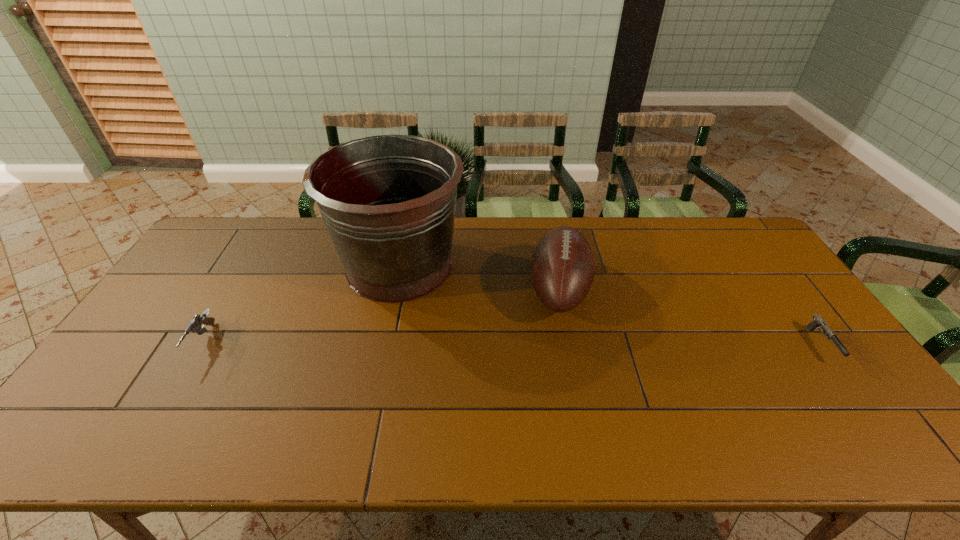
The height and width of the screenshot is (540, 960). I want to click on vacant area that lies between the bucket and the shortest object, so click(x=611, y=305).

Locate an element on the screen. The width and height of the screenshot is (960, 540). free spot between the second tallest object and the tallest object is located at coordinates (479, 278).

Find the location of `free space between the leftmost object and the right gun`. free space between the leftmost object and the right gun is located at coordinates (513, 343).

Where is `empty location between the shortest object and the second tallest object`? empty location between the shortest object and the second tallest object is located at coordinates (690, 317).

At what (x,y) coordinates should I click in order to perform the action: click on vacant area that lies between the bucket and the shortest object. Please return your answer as a coordinate pair (x, y). The width and height of the screenshot is (960, 540). Looking at the image, I should click on (611, 305).

Locate an element on the screen. The image size is (960, 540). vacant space that's between the right gun and the bucket is located at coordinates (611, 305).

In order to click on free space between the third shortest object and the third tallest object in this screenshot , I will do `click(381, 316)`.

This screenshot has height=540, width=960. Find the location of `vacant space in between the rightmost object and the second shortest object`. vacant space in between the rightmost object and the second shortest object is located at coordinates (513, 343).

Where is `vacant space that is in between the right gun and the third object from left to right`? The width and height of the screenshot is (960, 540). vacant space that is in between the right gun and the third object from left to right is located at coordinates (690, 317).

The width and height of the screenshot is (960, 540). In order to click on the closest object relative to the second object from left to right in this screenshot , I will do `click(562, 268)`.